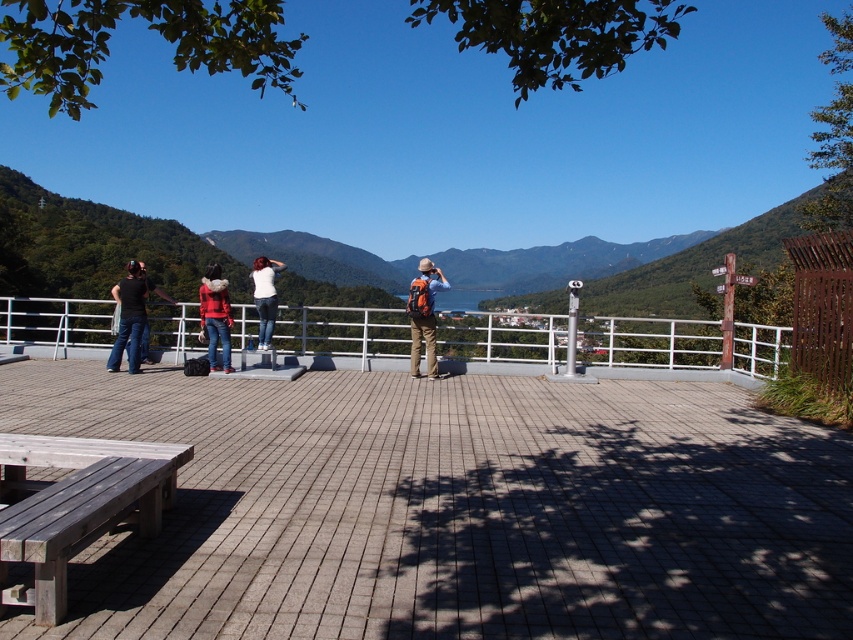
You are planning to place a new bench on the overlook platform. The bench requires a space that is wider than the orange backpack at center but narrower than the matte black shirt at left. Is there a suitable spot between these two objects to place the bench?

The orange backpack at center is thinner than the matte black shirt at left, so there is a suitable spot between them where the bench can be placed as it needs to be wider than the backpack but narrower than the shirt.

You are standing at the point marked by the coordinates point (215, 316) on the overlook platform. What color is the jacket of the person standing at your current location?

The person at point (215, 316) is wearing a matte red jacket.

You are standing on the overlook platform and want to take a photo of the mountain view. To ensure safety, you need to stay behind the white metal rail at center. Where exactly should you position yourself relative to the rail to take the photo?

You should position yourself behind the white metal rail at center to ensure safety while taking the photo.